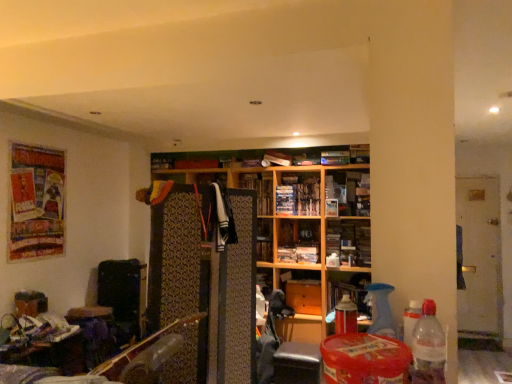
Question: Visually, is wooden bookshelf at center, which is counted as the third book, starting from the top, positioned to the left or to the right of matte wood cabinet at center, the 1th cabinet when ordered from right to left?

Choices:
 (A) left
 (B) right

Answer: (A)

Question: In terms of width, does wooden bookshelf at center, which is counted as the third book, starting from the top, look wider or thinner when compared to matte wood cabinet at center, the 1th cabinet when ordered from right to left?

Choices:
 (A) wide
 (B) thin

Answer: (B)

Question: Which object is the closest to the wooden cabinet at center, marked as the 1th cabinet in a left-to-right arrangement?

Choices:
 (A) matte white book at upper center, the 3th book when ordered from bottom to top
 (B) wooden bookshelf at center, which is counted as the third book, starting from the top
 (C) clear plastic bottle at lower right
 (D) wooden bookshelf at center
 (E) matte wood cabinet at center, arranged as the second cabinet when viewed from the left

Answer: (E)

Question: Estimate the real-world distances between objects in this image. Which object is farther from the matte plastic books at center, acting as the 2th book starting from the bottom?

Choices:
 (A) clear plastic bottle at lower right
 (B) wooden bookshelf at center, which is the first book from bottom to top
 (C) wooden bookshelf at center
 (D) matte wood cabinet at center, the 1th cabinet when ordered from right to left
 (E) wooden cabinet at center, the 2th cabinet when ordered from right to left

Answer: (A)